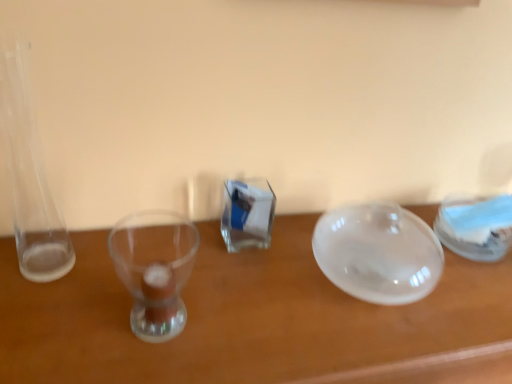
Question: Is transparent plastic container at right to the left of transparent glass bowl at center from the viewer's perspective?

Choices:
 (A) yes
 (B) no

Answer: (B)

Question: Is transparent plastic container at right positioned beyond the bounds of transparent glass bowl at center?

Choices:
 (A) no
 (B) yes

Answer: (B)

Question: Does transparent plastic container at right lie behind transparent glass bowl at center?

Choices:
 (A) yes
 (B) no

Answer: (A)

Question: Is transparent plastic container at right shorter than transparent glass bowl at center?

Choices:
 (A) no
 (B) yes

Answer: (B)

Question: From the image's perspective, would you say transparent plastic container at right is shown under transparent glass bowl at center?

Choices:
 (A) yes
 (B) no

Answer: (B)

Question: Is transparent plastic container at right at the right side of transparent glass bowl at center?

Choices:
 (A) yes
 (B) no

Answer: (A)

Question: Is transparent glass bowl at center oriented towards transparent plastic container at right?

Choices:
 (A) yes
 (B) no

Answer: (B)

Question: Is transparent glass bowl at center with transparent plastic container at right?

Choices:
 (A) no
 (B) yes

Answer: (A)

Question: Would you say transparent glass bowl at center is outside transparent plastic container at right?

Choices:
 (A) yes
 (B) no

Answer: (A)

Question: Is transparent glass bowl at center behind transparent plastic container at right?

Choices:
 (A) yes
 (B) no

Answer: (B)

Question: From the image's perspective, would you say transparent glass bowl at center is positioned over transparent plastic container at right?

Choices:
 (A) no
 (B) yes

Answer: (A)

Question: Is transparent glass bowl at center shorter than transparent plastic container at right?

Choices:
 (A) no
 (B) yes

Answer: (A)

Question: From a real-world perspective, is transparent glass bowl at center above or below transparent plastic container at right?

Choices:
 (A) below
 (B) above

Answer: (A)